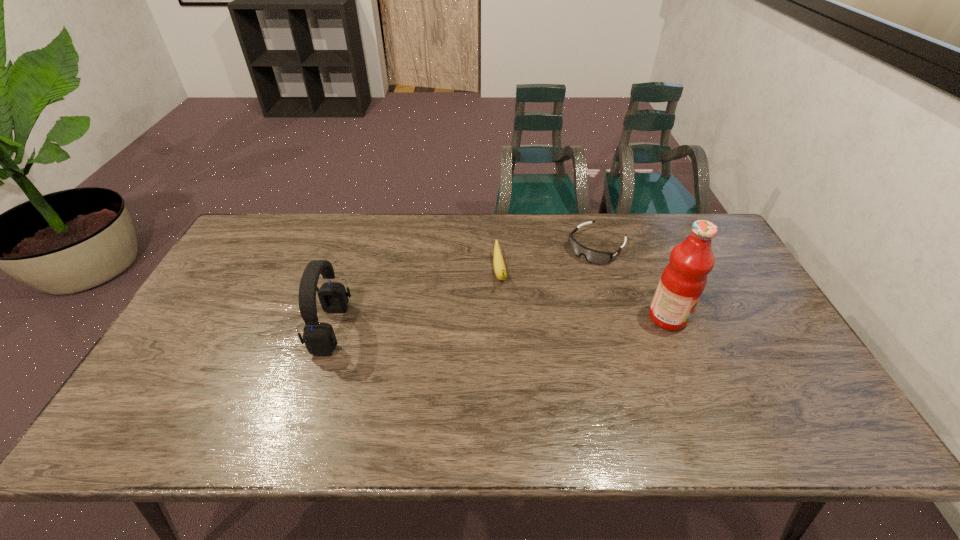
Where is `free space located 0.110m on the front and sides of the shortest object`? free space located 0.110m on the front and sides of the shortest object is located at coordinates (563, 279).

At what (x,y) coordinates should I click in order to perform the action: click on vacant space located on the front and sides of the shortest object. Please return your answer as a coordinate pair (x, y). This screenshot has height=540, width=960. Looking at the image, I should click on (521, 318).

Identify the location of free space located on the front and sides of the shortest object. The height and width of the screenshot is (540, 960). (549, 291).

Locate an element on the screen. free space located 0.240m at the stem of the second shortest object is located at coordinates (514, 360).

Where is `free space located at the stem of the second shortest object`? The height and width of the screenshot is (540, 960). free space located at the stem of the second shortest object is located at coordinates (519, 394).

Locate an element on the screen. This screenshot has height=540, width=960. vacant space located at the stem of the second shortest object is located at coordinates (504, 306).

This screenshot has height=540, width=960. I want to click on goggles that is at the far edge, so click(x=593, y=256).

This screenshot has width=960, height=540. In order to click on banana at the far edge in this screenshot , I will do `click(499, 267)`.

Identify the location of vacant area at the far edge. (363, 228).

Locate an element on the screen. The width and height of the screenshot is (960, 540). vacant space at the near edge of the desktop is located at coordinates (510, 378).